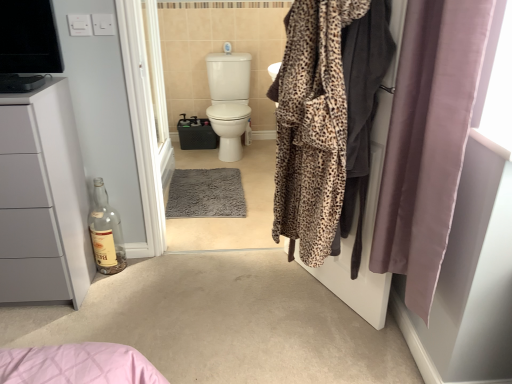
The width and height of the screenshot is (512, 384). Find the location of `vacant space in leopard print robe at center, the first screen door in the right-to-left sequence (from a real-world perspective)`. vacant space in leopard print robe at center, the first screen door in the right-to-left sequence (from a real-world perspective) is located at coordinates (310, 304).